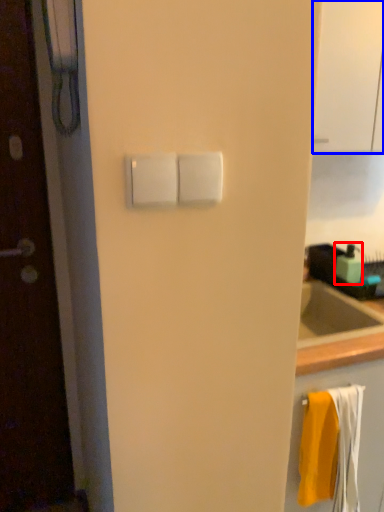
Question: Among these objects, which one is farthest to the camera, soap dispenser (highlighted by a red box) or glass door (highlighted by a blue box)?

Choices:
 (A) soap dispenser
 (B) glass door

Answer: (A)